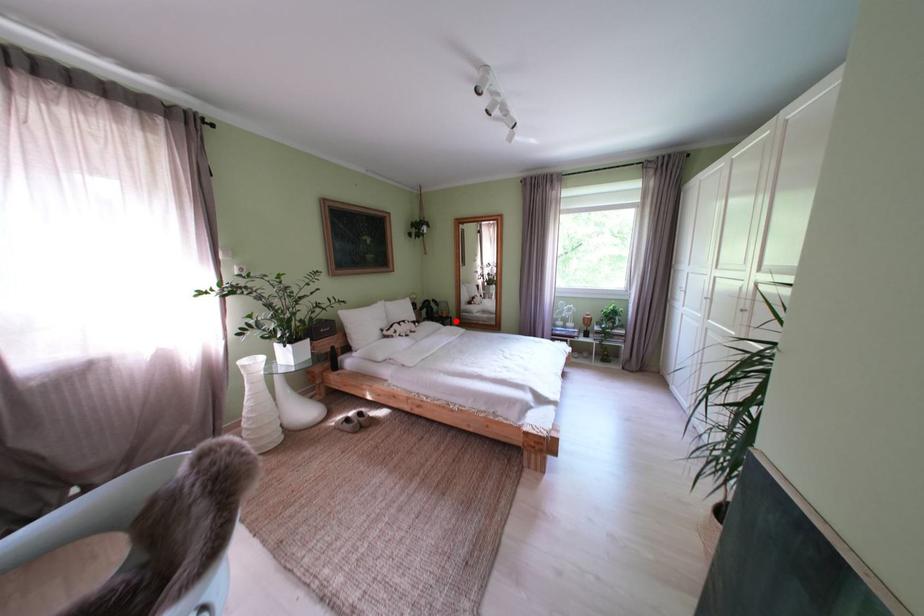
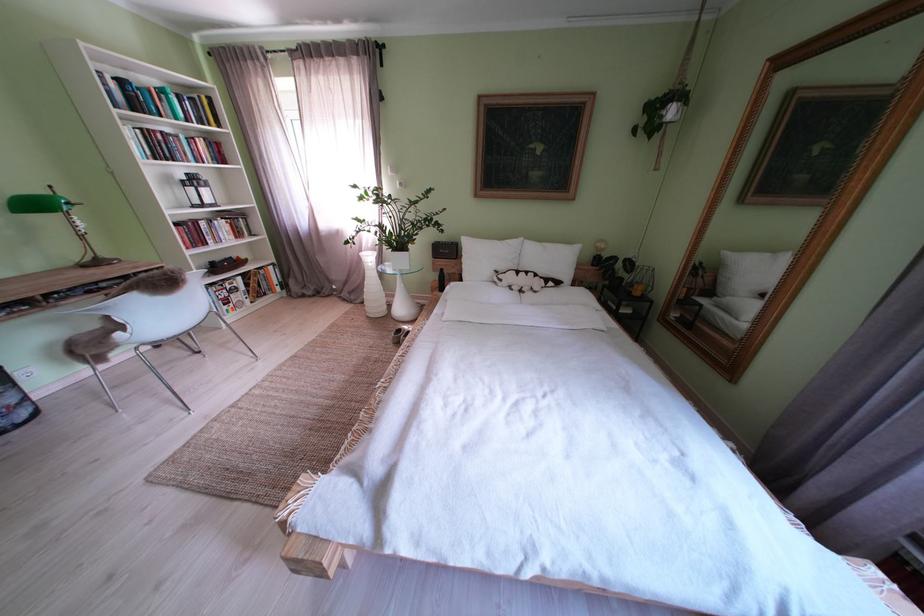
Find the pixel in the second image that matches the highlighted location in the first image.

(648, 299)